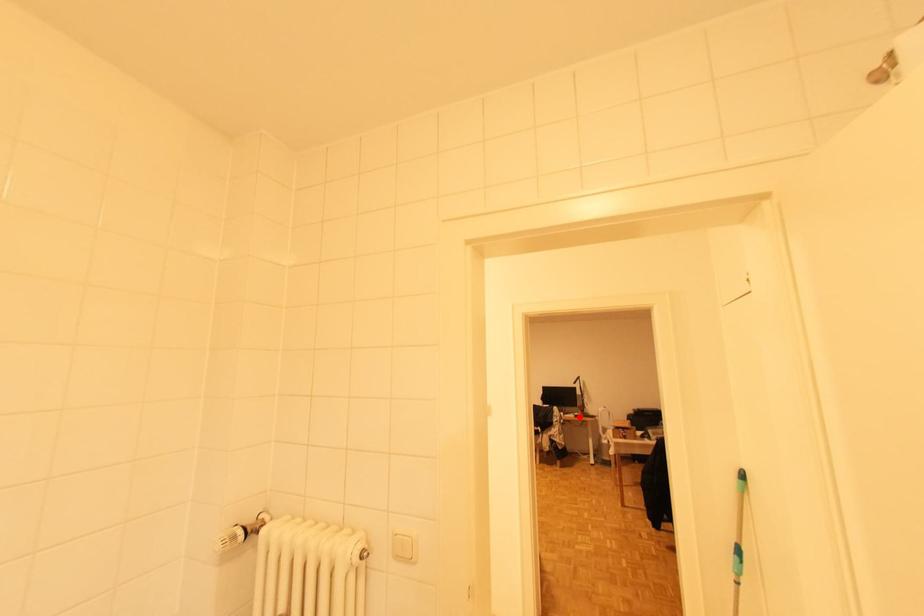
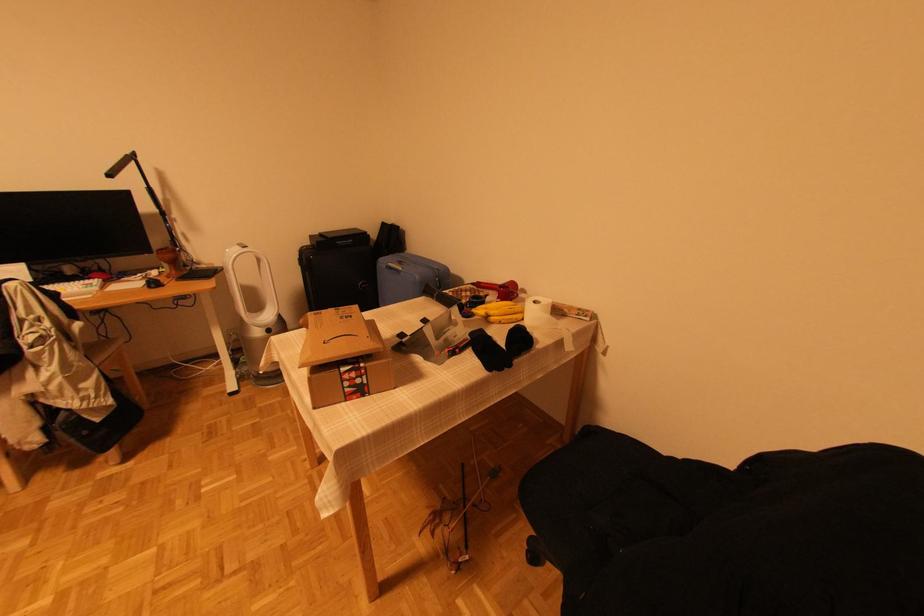
Locate, in the second image, the point that corresponds to the highlighted location in the first image.

(156, 284)